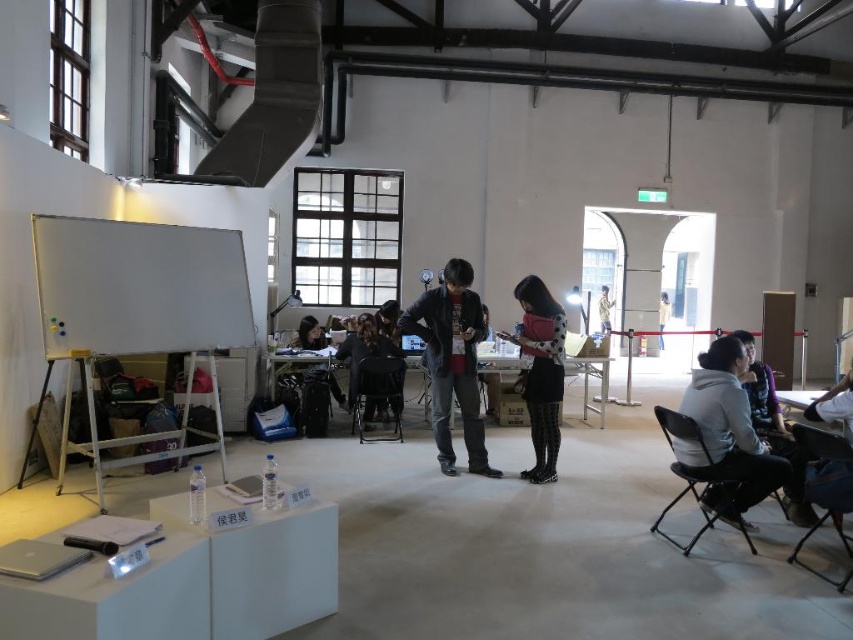
Is point (363, 369) less distant than point (312, 317)?

Yes, it is.

The width and height of the screenshot is (853, 640). Describe the element at coordinates (379, 394) in the screenshot. I see `black plastic chair at center` at that location.

Does point (360, 381) lie behind point (318, 332)?

No, (360, 381) is closer to viewer.

Where is `black plastic chair at center`? This screenshot has width=853, height=640. black plastic chair at center is located at coordinates (379, 394).

Does white matte projection screen at left have a lesser width compared to black fabric chair at lower right?

No, white matte projection screen at left is not thinner than black fabric chair at lower right.

Between point (202, 234) and point (811, 449), which one is positioned behind?

The point (202, 234) is behind.

Who is more distant from viewer, (53, 305) or (850, 468)?

Positioned behind is point (53, 305).

What are the coordinates of `white matte projection screen at left` in the screenshot? It's located at (138, 288).

Is white matte easel at left closer to the viewer compared to khaki cotton shirt at center?

Yes, white matte easel at left is in front of khaki cotton shirt at center.

Which of these two, white matte easel at left or khaki cotton shirt at center, stands taller?

With more height is white matte easel at left.

Who is more distant from viewer, (59,337) or (602,328)?

Point (602,328)

Locate an element on the screen. This screenshot has width=853, height=640. white matte easel at left is located at coordinates (138, 314).